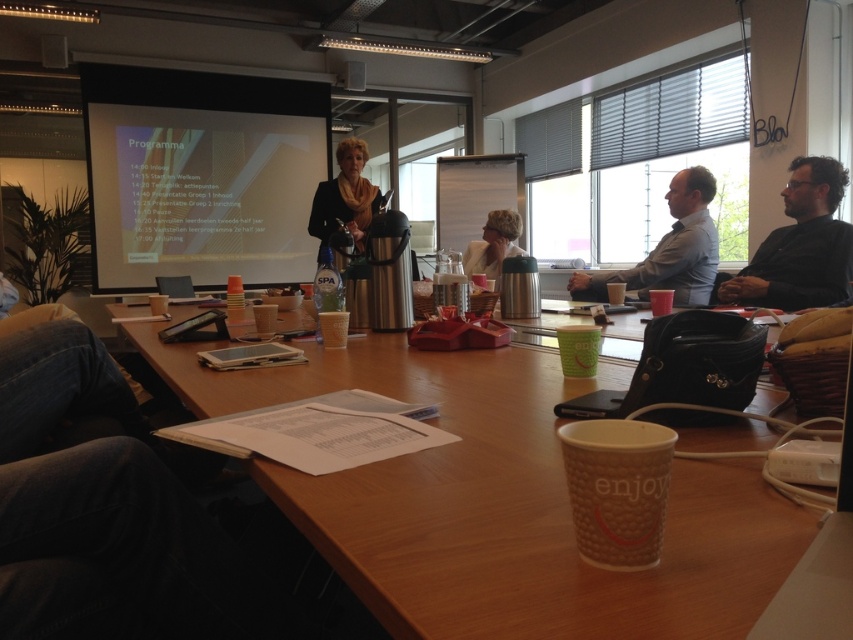
Can you confirm if white matte projection screen at upper left is taller than matte blue shirt at upper right?

Yes, white matte projection screen at upper left is taller than matte blue shirt at upper right.

The image size is (853, 640). What do you see at coordinates (200, 173) in the screenshot?
I see `white matte projection screen at upper left` at bounding box center [200, 173].

Where is `white matte projection screen at upper left`? The height and width of the screenshot is (640, 853). white matte projection screen at upper left is located at coordinates (200, 173).

Does brown paper cup at center have a lesser width compared to black matte shirt at right?

In fact, brown paper cup at center might be wider than black matte shirt at right.

Does brown paper cup at center appear over black matte shirt at right?

Incorrect, brown paper cup at center is not positioned above black matte shirt at right.

Which is behind, point (357, 355) or point (817, 205)?

Positioned behind is point (817, 205).

At what (x,y) coordinates should I click in order to perform the action: click on brown paper cup at center. Please return your answer as a coordinate pair (x, y). The height and width of the screenshot is (640, 853). Looking at the image, I should click on (500, 502).

Can you confirm if white matte projection screen at upper left is positioned above black fabric jacket at center?

Indeed, white matte projection screen at upper left is positioned over black fabric jacket at center.

Can you confirm if white matte projection screen at upper left is taller than black fabric jacket at center?

Yes, white matte projection screen at upper left is taller than black fabric jacket at center.

Describe the element at coordinates (200, 173) in the screenshot. This screenshot has height=640, width=853. I see `white matte projection screen at upper left` at that location.

You are a GUI agent. You are given a task and a screenshot of the screen. Output one action in this format:
    pyautogui.click(x=<x>, y=<y>)
    Task: Click on the white matte projection screen at upper left
    The image size is (853, 640).
    Given the screenshot: What is the action you would take?
    pyautogui.click(x=200, y=173)